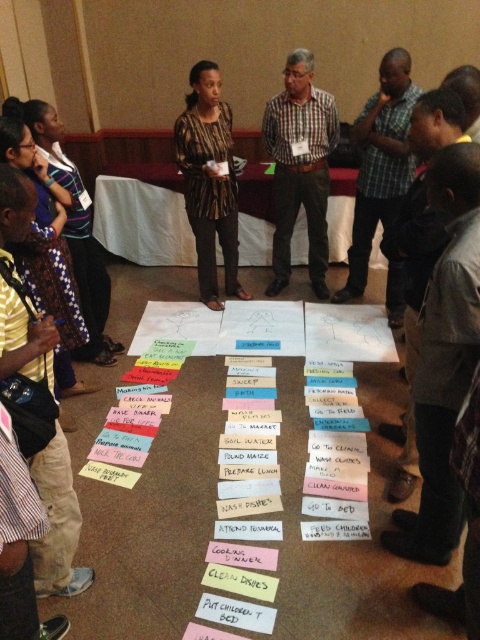
Does plaid shirt at center have a greater width compared to patterned fabric shirt at center?

No.

Does plaid shirt at center have a lesser height compared to patterned fabric shirt at center?

Yes, plaid shirt at center is shorter than patterned fabric shirt at center.

Locate an element on the screen. plaid shirt at center is located at coordinates tap(380, 163).

Find the location of a particular element. This screenshot has height=640, width=480. plaid shirt at center is located at coordinates point(380,163).

Is checkered fabric shirt at center to the left of plaid shirt at center from the viewer's perspective?

Correct, you'll find checkered fabric shirt at center to the left of plaid shirt at center.

Is checkered fabric shirt at center bigger than plaid shirt at center?

Yes.

Find the location of `checkered fabric shirt at center`. checkered fabric shirt at center is located at coordinates (300, 168).

Is yellow striped shirt at left smaller than checkered fabric shirt at center?

Yes.

In order to click on yellow striped shirt at left in this screenshot , I will do `click(58, 522)`.